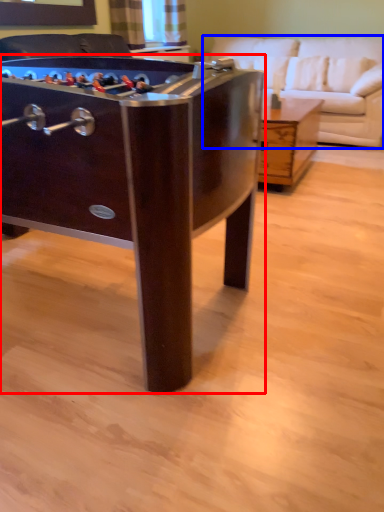
Question: Which point is further to the camera, table (highlighted by a red box) or studio couch (highlighted by a blue box)?

Choices:
 (A) table
 (B) studio couch

Answer: (B)